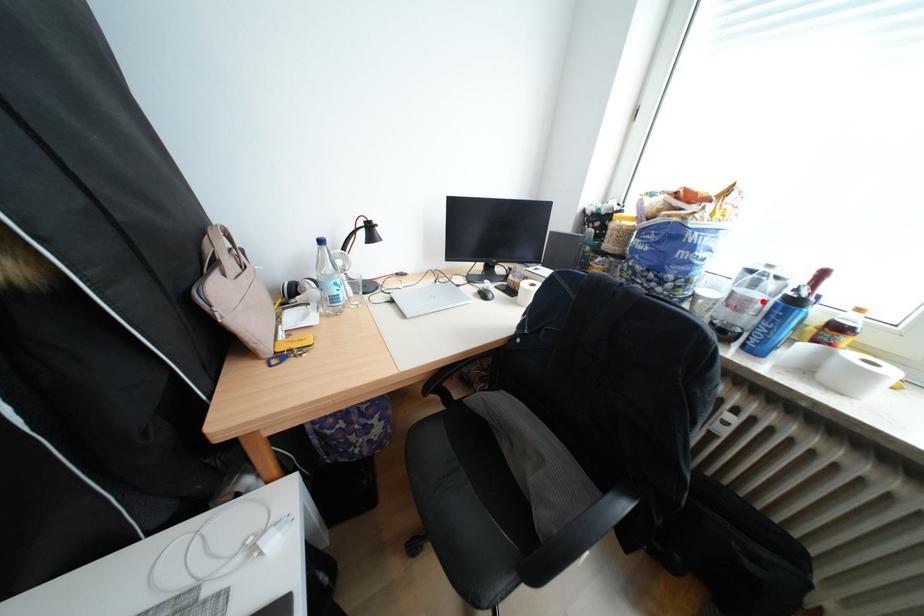
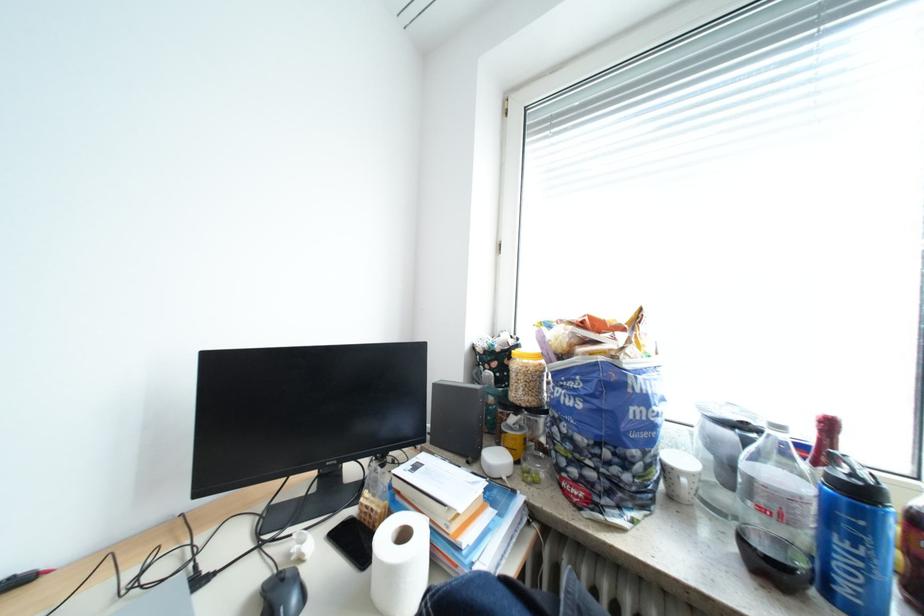
Question: I am providing you with two images of the same scene from different viewpoints. Given a red point in image1, look at the same physical point in image2. Is it:

Choices:
 (A) Closer to the viewpoint
 (B) Farther from the viewpoint

Answer: (A)